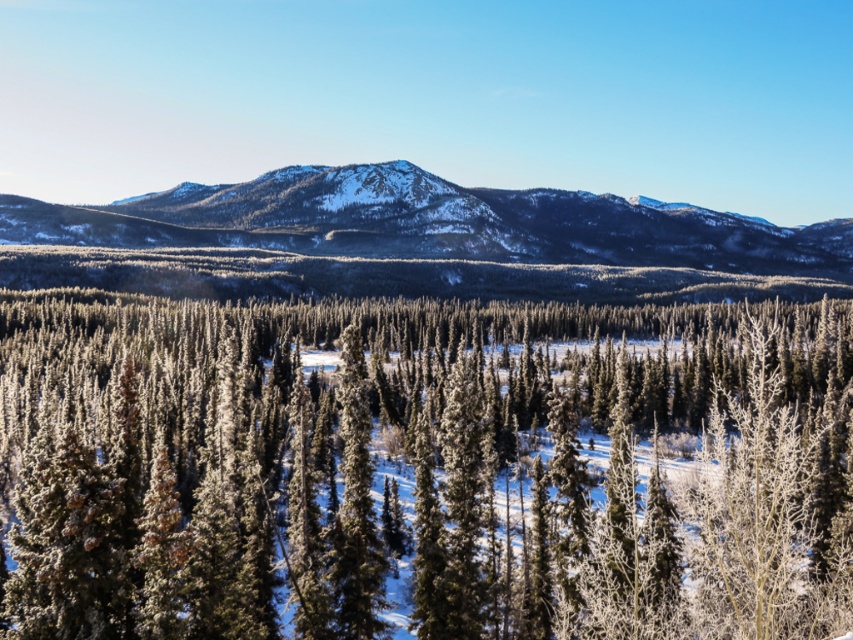
Question: Does snow-covered evergreen trees at center appear over snowy rocky mountain at center?

Choices:
 (A) no
 (B) yes

Answer: (A)

Question: Is snow-covered evergreen trees at center thinner than snowy rocky mountain at center?

Choices:
 (A) yes
 (B) no

Answer: (A)

Question: Can you confirm if snow-covered evergreen trees at center is bigger than snowy rocky mountain at center?

Choices:
 (A) no
 (B) yes

Answer: (A)